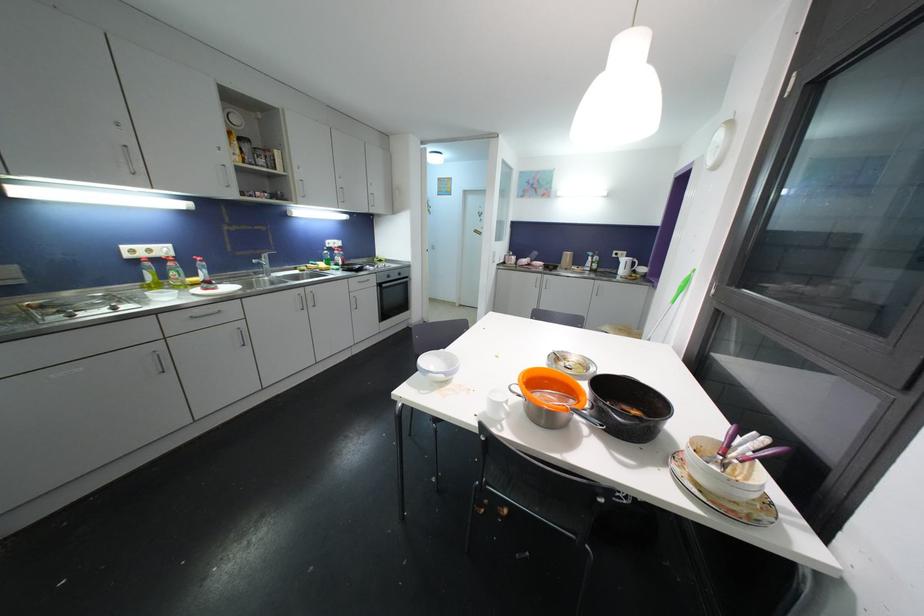
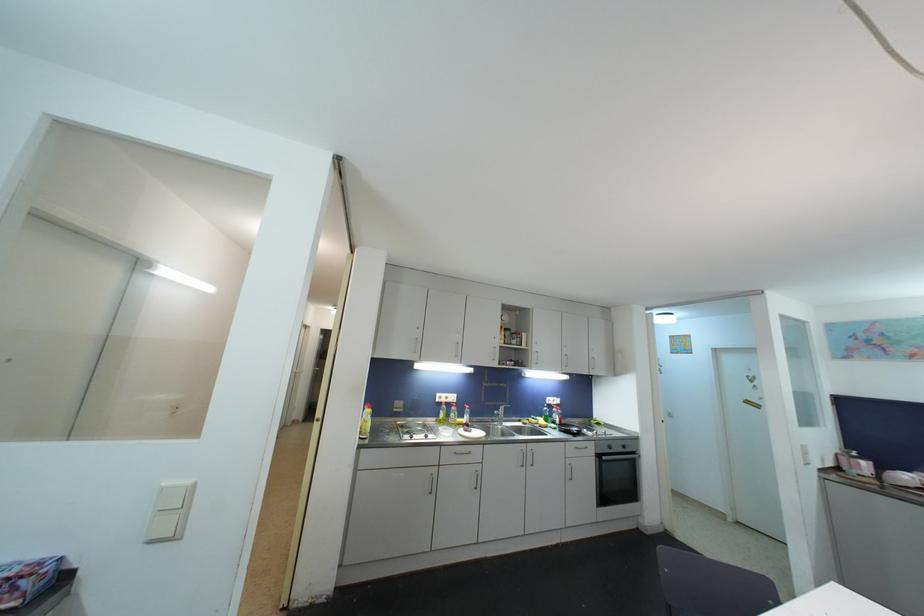
In the second image, find the point that corresponds to (x=313, y=306) in the first image.

(532, 464)